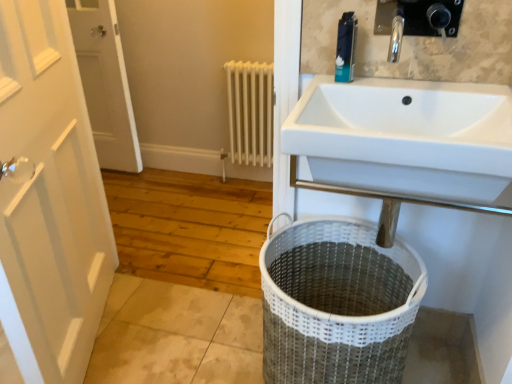
Question: Relative to white wooden door at left, the first door in the left-to-right sequence, is blue plastic toothpaste tube at upper center in front or behind?

Choices:
 (A) behind
 (B) front

Answer: (B)

Question: In terms of size, does blue plastic toothpaste tube at upper center appear bigger or smaller than white wooden door at left, the first door in the left-to-right sequence?

Choices:
 (A) big
 (B) small

Answer: (B)

Question: Estimate the real-world distances between objects in this image. Which object is farther from the white wooden door at left, which is the first door from right to left?

Choices:
 (A) blue plastic toothpaste tube at upper center
 (B) white wooden door at left, the first door in the left-to-right sequence
 (C) white woven laundry basket at lower center
 (D) white metal radiator at center

Answer: (B)

Question: Which object is positioned closest to the white wooden door at left, which is the first door from right to left?

Choices:
 (A) blue plastic toothpaste tube at upper center
 (B) white metal radiator at center
 (C) white wooden door at left, the first door in the left-to-right sequence
 (D) white woven laundry basket at lower center

Answer: (D)